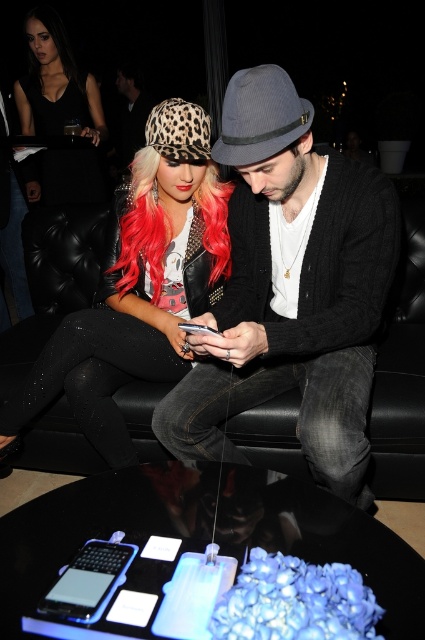
The height and width of the screenshot is (640, 425). I want to click on leopard print hat at center, so click(139, 285).

Does point (2, 429) lie behind point (138, 182)?

That is False.

Where is `leopard print hat at center`? Image resolution: width=425 pixels, height=640 pixels. leopard print hat at center is located at coordinates (139, 285).

Can you confirm if matte black dress at upper left is positioned above pinkhair at center?

Yes, matte black dress at upper left is above pinkhair at center.

Which of these two, matte black dress at upper left or pinkhair at center, stands taller?

matte black dress at upper left

I want to click on matte black dress at upper left, so click(56, 83).

At what (x,y) coordinates should I click in order to perform the action: click on matte black dress at upper left. Please return your answer as a coordinate pair (x, y). Image resolution: width=425 pixels, height=640 pixels. Looking at the image, I should click on (56, 83).

Is matte gray fedora at center bigger than matte black dress at upper left?

Yes, matte gray fedora at center is bigger than matte black dress at upper left.

Between matte gray fedora at center and matte black dress at upper left, which one is positioned lower?

matte gray fedora at center is lower down.

Who is more distant from viewer, (294,144) or (73,67)?

Positioned behind is point (73,67).

The image size is (425, 640). I want to click on matte gray fedora at center, so click(x=291, y=289).